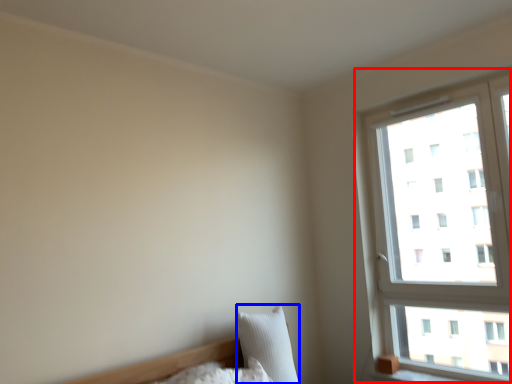
Question: Which of the following is the closest to the observer, window (highlighted by a red box) or pillow (highlighted by a blue box)?

Choices:
 (A) window
 (B) pillow

Answer: (A)